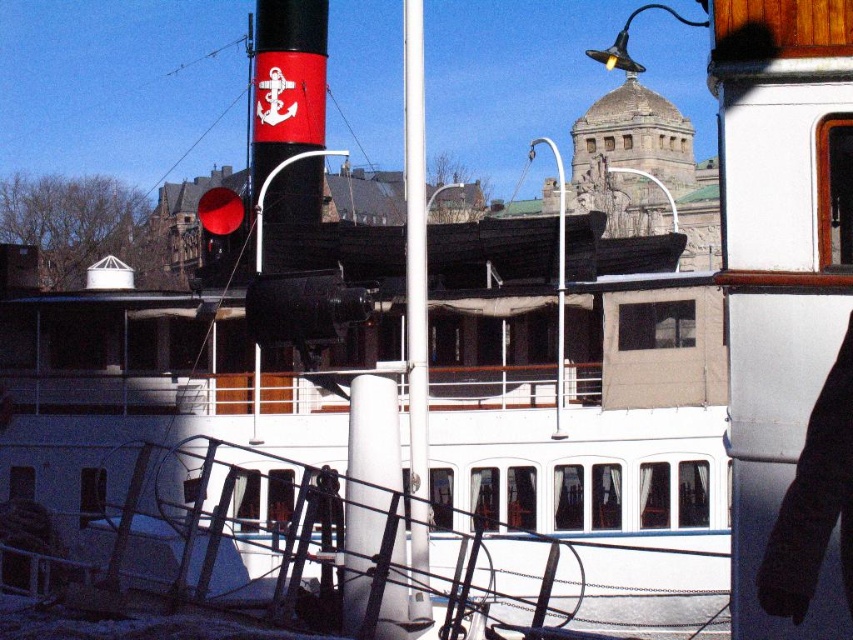
Question: Is white glossy pole at center bigger than white metal pole at center?

Choices:
 (A) yes
 (B) no

Answer: (B)

Question: Which point is farther to the camera?

Choices:
 (A) (418, 554)
 (B) (561, 205)

Answer: (B)

Question: Is white glossy pole at center in front of white metal pole at center?

Choices:
 (A) yes
 (B) no

Answer: (A)

Question: Is the position of white glossy pole at center less distant than that of white metal pole at center?

Choices:
 (A) yes
 (B) no

Answer: (A)